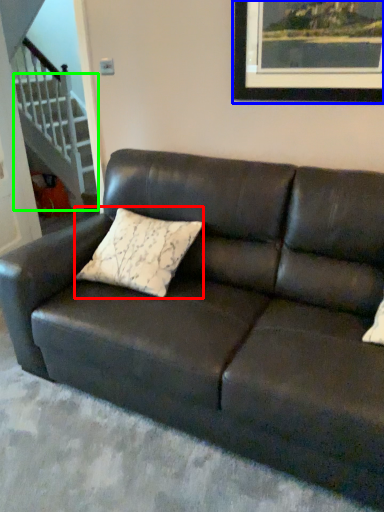
Question: Which object is the closest to the pillow (highlighted by a red box)? Choose among these: picture frame (highlighted by a blue box) or stairwell (highlighted by a green box).

Choices:
 (A) picture frame
 (B) stairwell

Answer: (A)